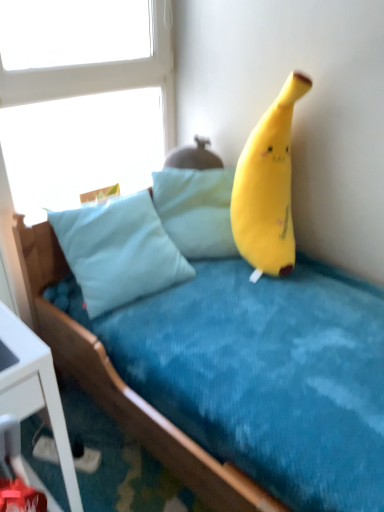
Question: Does soft yellow plush at upper right lie behind soft blue fabric bed at upper right?

Choices:
 (A) no
 (B) yes

Answer: (B)

Question: Does soft yellow plush at upper right have a smaller size compared to soft blue fabric bed at upper right?

Choices:
 (A) yes
 (B) no

Answer: (A)

Question: From the image's perspective, does soft yellow plush at upper right appear lower than soft blue fabric bed at upper right?

Choices:
 (A) yes
 (B) no

Answer: (B)

Question: Is soft yellow plush at upper right oriented away from soft blue fabric bed at upper right?

Choices:
 (A) no
 (B) yes

Answer: (A)

Question: Can we say soft yellow plush at upper right lies outside soft blue fabric bed at upper right?

Choices:
 (A) no
 (B) yes

Answer: (A)

Question: Is soft yellow plush at upper right shorter than soft blue fabric bed at upper right?

Choices:
 (A) yes
 (B) no

Answer: (A)

Question: Is light blue fabric pillow at center positioned behind soft blue fabric bed at upper right?

Choices:
 (A) no
 (B) yes

Answer: (B)

Question: Is soft blue fabric bed at upper right inside light blue fabric pillow at center?

Choices:
 (A) no
 (B) yes

Answer: (A)

Question: Is light blue fabric pillow at center not inside soft blue fabric bed at upper right?

Choices:
 (A) no
 (B) yes

Answer: (A)

Question: Is the surface of light blue fabric pillow at center in direct contact with soft blue fabric bed at upper right?

Choices:
 (A) yes
 (B) no

Answer: (B)

Question: Is light blue fabric pillow at center bigger than soft blue fabric bed at upper right?

Choices:
 (A) no
 (B) yes

Answer: (A)

Question: Is light blue fabric pillow at center thinner than soft blue fabric bed at upper right?

Choices:
 (A) no
 (B) yes

Answer: (B)

Question: From a real-world perspective, is soft blue fabric bed at upper right beneath light blue fabric pillow at center?

Choices:
 (A) yes
 (B) no

Answer: (A)